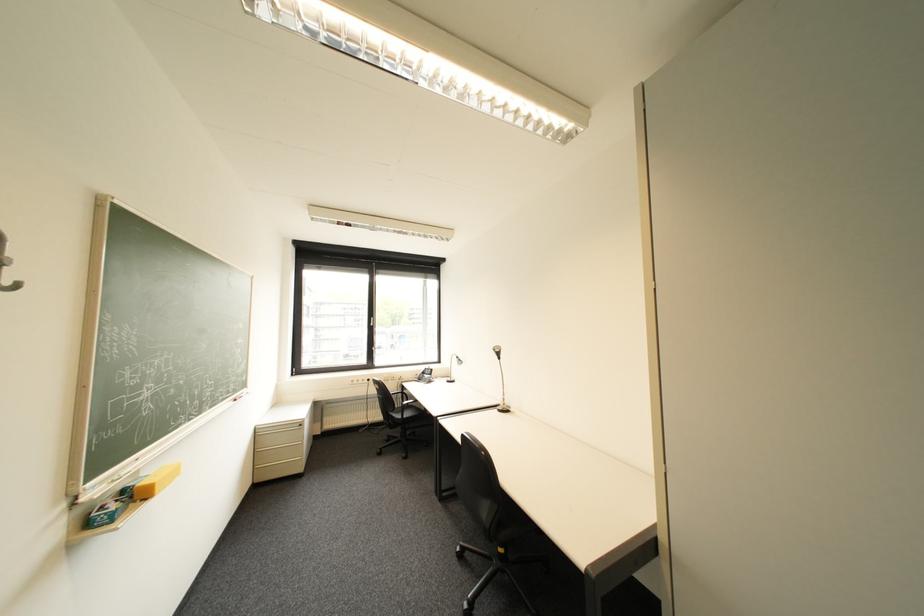
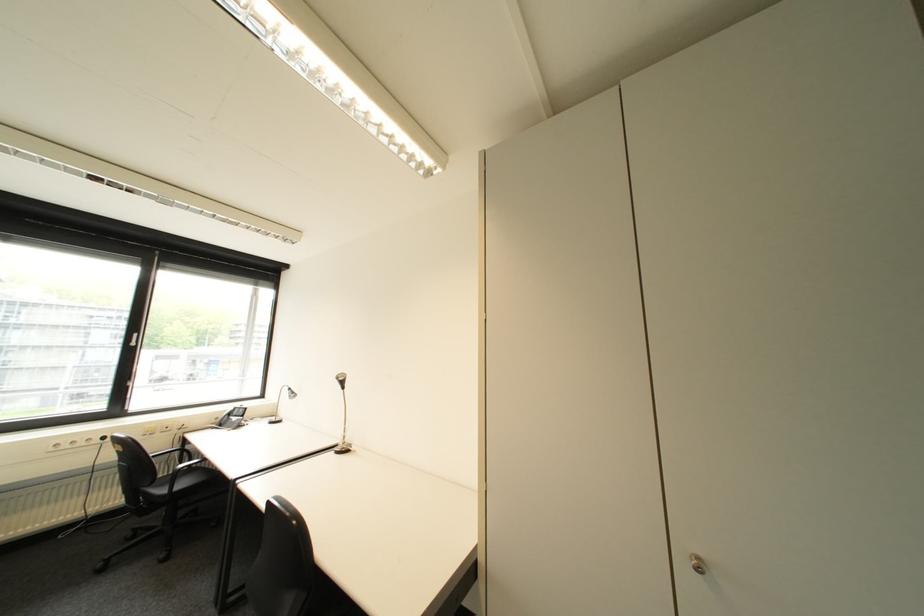
Where in the second image is the point corresponding to (507,408) from the first image?

(346, 450)